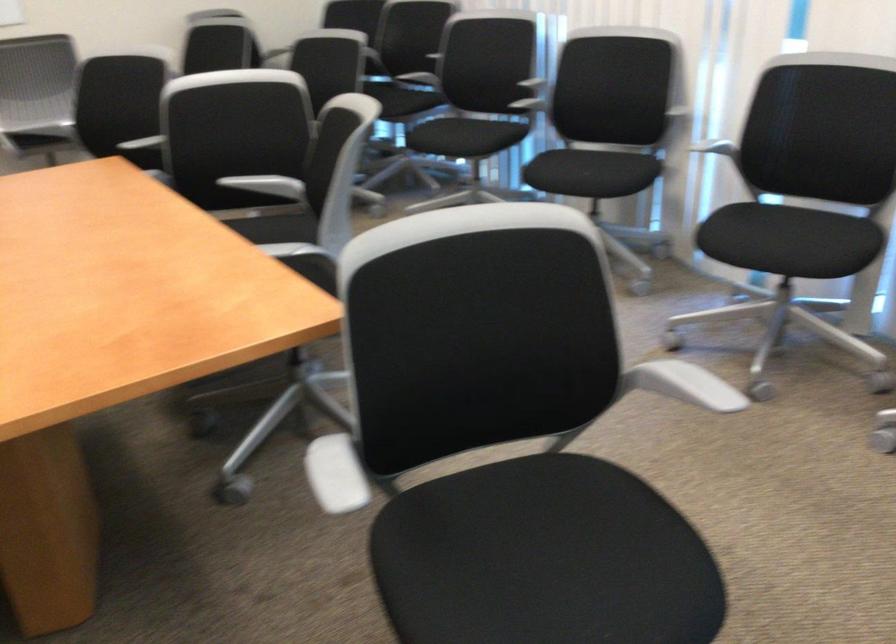
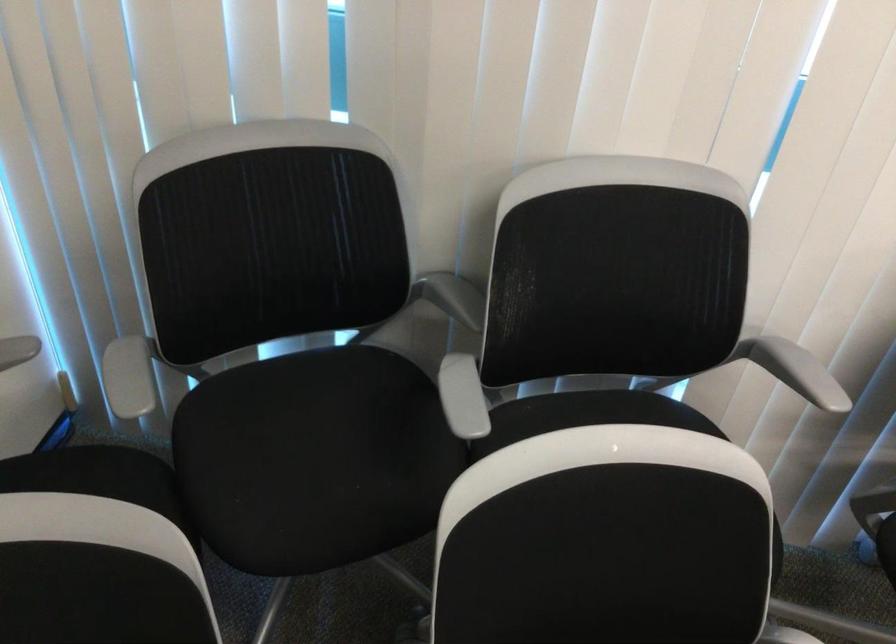
The point at (423, 87) is marked in the first image. Where is the corresponding point in the second image?

(605, 412)